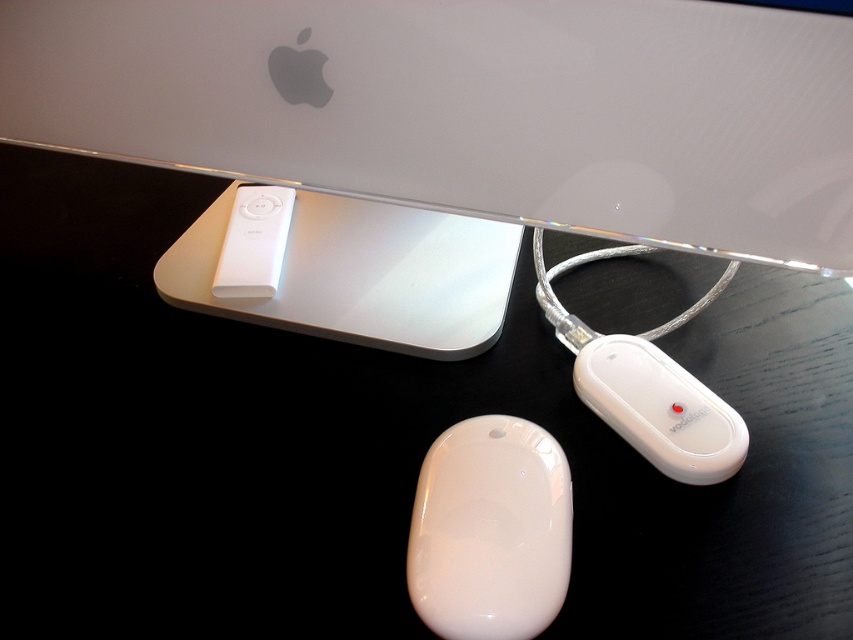
Question: Which point appears closest to the camera in this image?

Choices:
 (A) (480, 506)
 (B) (664, 388)

Answer: (A)

Question: Is sleek silver laptop at upper center wider than white glossy charger at lower center?

Choices:
 (A) no
 (B) yes

Answer: (B)

Question: Can you confirm if glossy white mouse at lower center is thinner than white glossy charger at lower center?

Choices:
 (A) yes
 (B) no

Answer: (A)

Question: Which object is farther from the camera taking this photo?

Choices:
 (A) white glossy charger at lower center
 (B) sleek silver laptop at upper center
 (C) glossy white mouse at lower center

Answer: (A)

Question: Among these objects, which one is farthest from the camera?

Choices:
 (A) white glossy charger at lower center
 (B) sleek silver laptop at upper center
 (C) glossy white mouse at lower center

Answer: (A)

Question: Is sleek silver laptop at upper center closer to camera compared to white glossy charger at lower center?

Choices:
 (A) yes
 (B) no

Answer: (A)